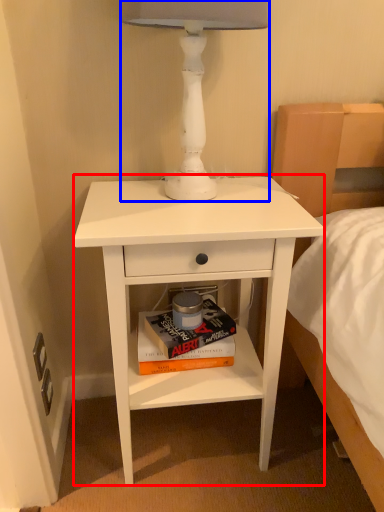
Question: Among these objects, which one is nearest to the camera, nightstand (highlighted by a red box) or table lamp (highlighted by a blue box)?

Choices:
 (A) nightstand
 (B) table lamp

Answer: (B)